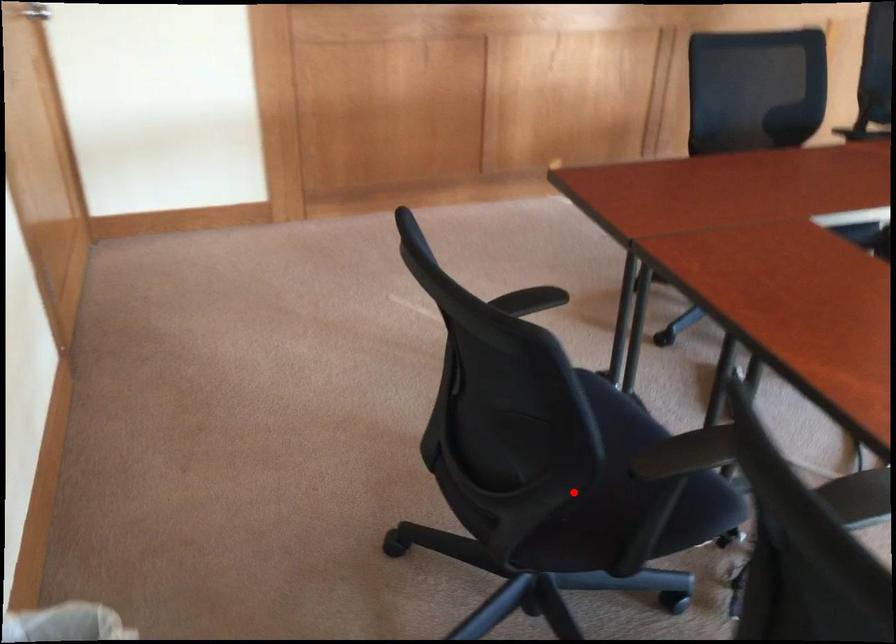
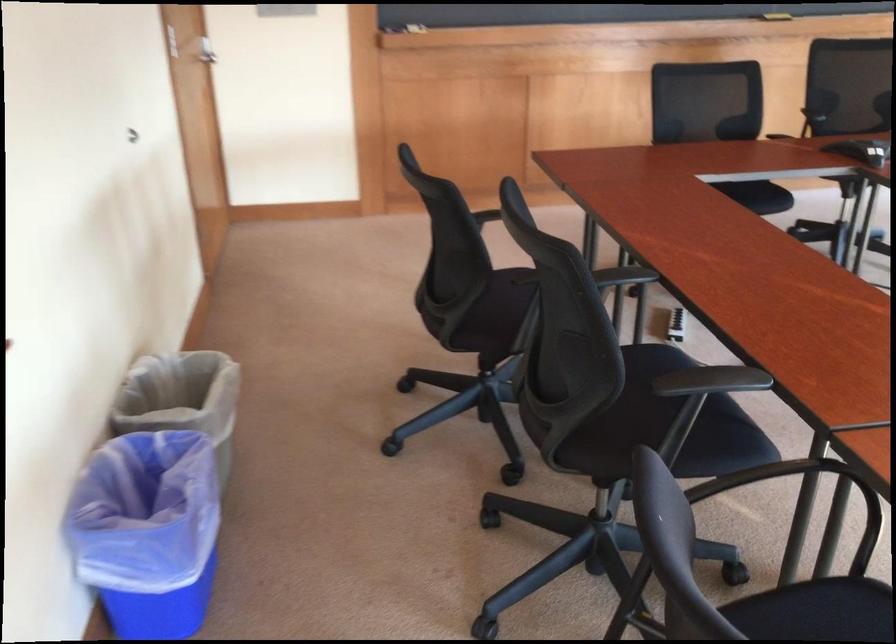
Question: A red point is marked in image1. In image2, is the corresponding 3D point closer to the camera or farther? Reply with the corresponding letter.

Choices:
 (A) The corresponding 3D point is closer.
 (B) The corresponding 3D point is farther.

Answer: (B)